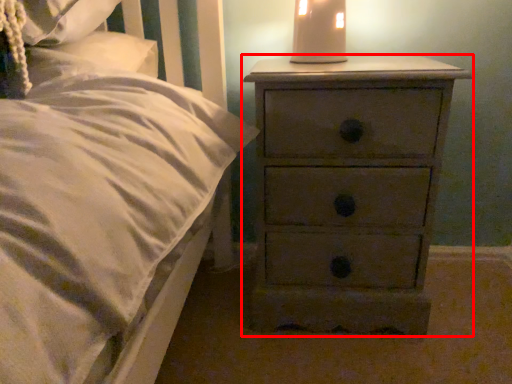
Question: In this image, where is chest of drawers (annotated by the red box) located relative to bedside lamp?

Choices:
 (A) left
 (B) right

Answer: (B)